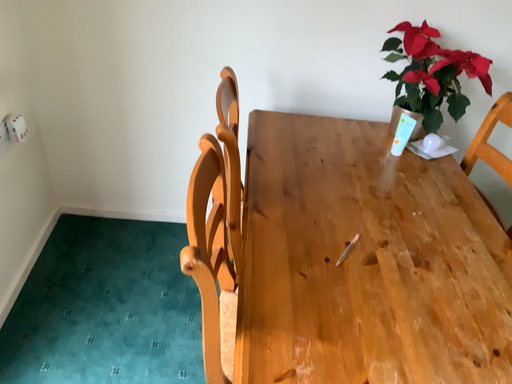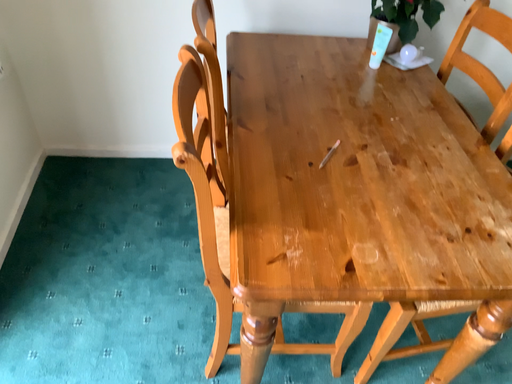
Question: Which way did the camera rotate in the video?

Choices:
 (A) rotated upward
 (B) rotated downward

Answer: (B)